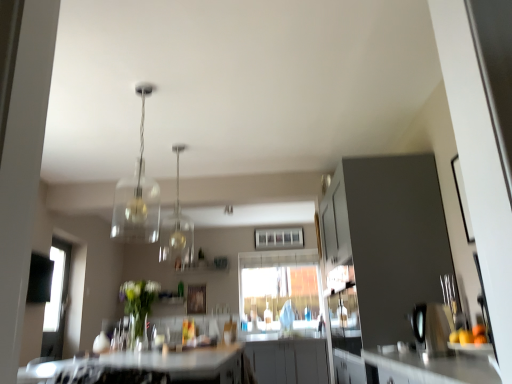
Question: From the image's perspective, is white glossy countertop at lower center above or below clear glass window at center, the 1th window positioned from the top?

Choices:
 (A) below
 (B) above

Answer: (A)

Question: Choose the correct answer: Is white glossy countertop at lower center inside clear glass window at center, positioned as the 2th window in bottom-to-top order, or outside it?

Choices:
 (A) outside
 (B) inside

Answer: (A)

Question: Estimate the real-world distances between objects in this image. Which object is farther from the transparent glass window at center, which appears as the 1th window when ordered from the bottom?

Choices:
 (A) clear glass pendant light at center, which is counted as the 2th light fixture, starting from the front
 (B) clear glass window at center, the 1th window positioned from the top
 (C) wooden cutting board at right
 (D) matte gray cabinet at right
 (E) white glossy countertop at lower center

Answer: (C)

Question: Estimate the real-world distances between objects in this image. Which object is farther from the wooden cutting board at right?

Choices:
 (A) clear glass pendant light at center, which is counted as the 2th light fixture, starting from the front
 (B) white glossy countertop at lower center
 (C) matte gray cabinet at right
 (D) transparent glass window at center, which appears as the 1th window when ordered from the bottom
 (E) clear glass window at center, positioned as the 2th window in bottom-to-top order

Answer: (A)